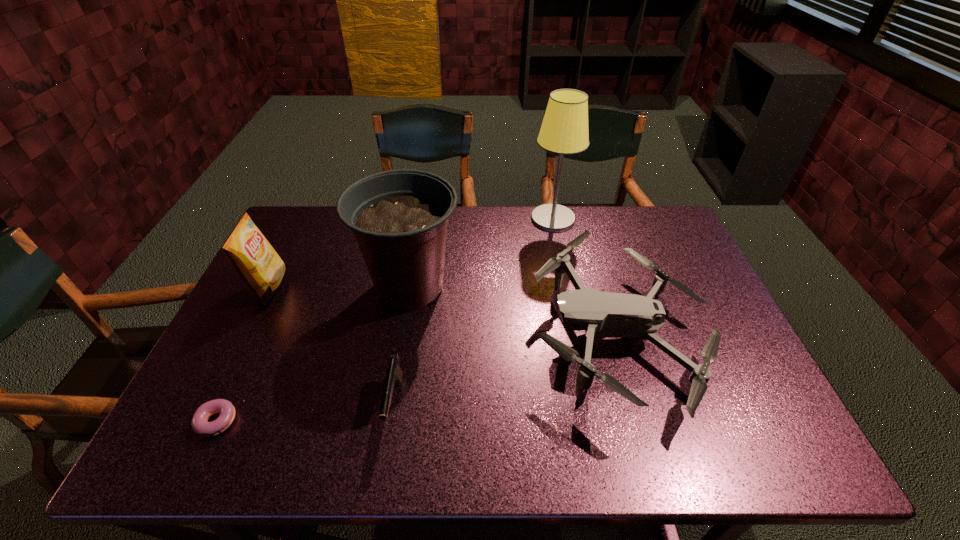
What are the coordinates of `vacant space that satisfies the following two spatial constraints: 1. with a camera at the front of the third shortest object; 2. at the muzzle of the second shortest object` in the screenshot? It's located at (636, 405).

Where is `vacant space that satisfies the following two spatial constraints: 1. with a camera at the front of the drone; 2. on the front side of the shortest object`? The width and height of the screenshot is (960, 540). vacant space that satisfies the following two spatial constraints: 1. with a camera at the front of the drone; 2. on the front side of the shortest object is located at coordinates (640, 421).

Where is `vacant space that satisfies the following two spatial constraints: 1. on the front-facing side of the crisp (potato chip); 2. on the right side of the shortest object`? This screenshot has width=960, height=540. vacant space that satisfies the following two spatial constraints: 1. on the front-facing side of the crisp (potato chip); 2. on the right side of the shortest object is located at coordinates (202, 421).

Locate an element on the screen. vacant space that satisfies the following two spatial constraints: 1. on the front-facing side of the shortest object; 2. on the right side of the crisp (potato chip) is located at coordinates (202, 421).